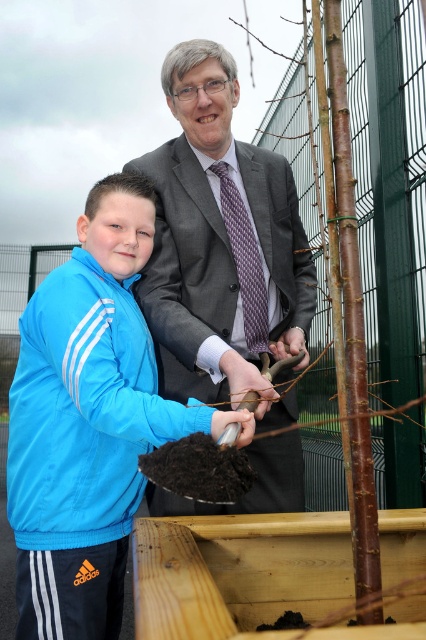
You are a photographer trying to capture a closeup of the purple textured tie at center without including the brown rough bark tree at center in the frame. Based on their positions, can you position yourself in a way to achieve this?

The brown rough bark tree at center is to the right of the purple textured tie at center. To capture the purple textured tie at center without the tree, position yourself to the left side of the purple textured tie at center so the tree is out of frame.

You are standing at the camera position and want to water the brown rough bark tree at center. You have a watering can that can spray water up to 3 meters. Can you water it without moving closer?

The brown rough bark tree at center is 3.59 meters from camera. Since the watering can can only spray up to 3 meters, you cannot reach it without moving closer.

You are a gardener trying to determine the correct order of planting steps. Based on the image, which object is located to the left of the other between the brown rough bark tree at center and the matte black glove at center?

The matte black glove at center is located to the left of the brown rough bark tree at center because the tree is positioned on the right side of the glove.